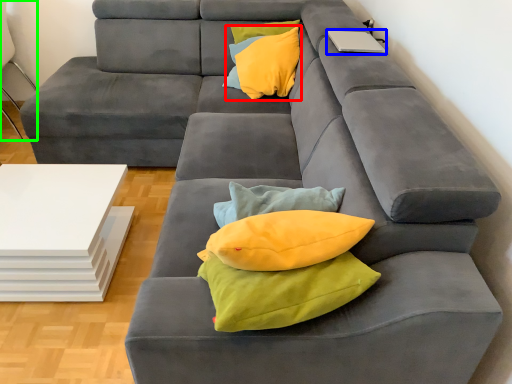
Question: Which object is positioned closest to throw pillow (highlighted by a red box)? Select from laptop (highlighted by a blue box) and armchair (highlighted by a green box).

Choices:
 (A) laptop
 (B) armchair

Answer: (A)